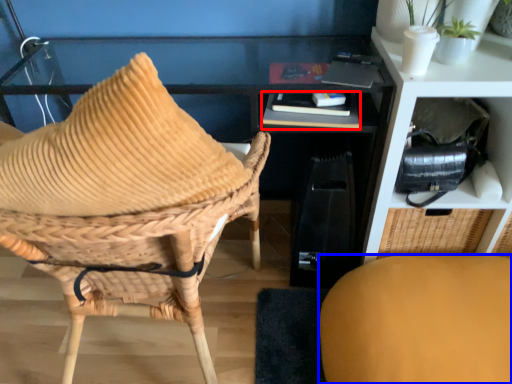
Question: Which object is closer to the camera taking this photo, book (highlighted by a red box) or chair (highlighted by a blue box)?

Choices:
 (A) book
 (B) chair

Answer: (B)